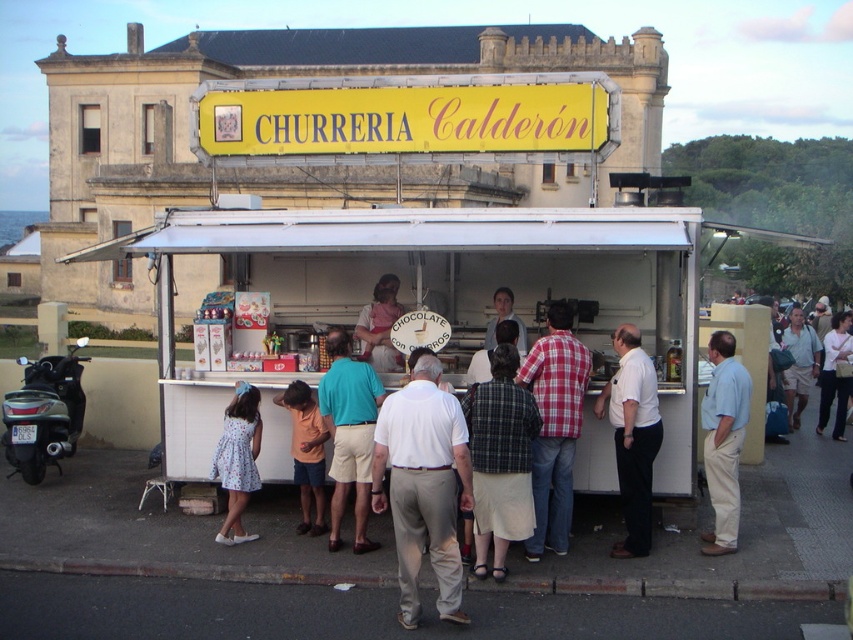
Locate an element on the screen. The image size is (853, 640). white shirt at center is located at coordinates (631, 436).

Does point (624, 328) come closer to viewer compared to point (798, 321)?

Yes, it is.

Find the location of a particular element. The image size is (853, 640). white shirt at center is located at coordinates (631, 436).

Is plaid fabric jacket at center shorter than khaki cotton shorts at center?

Yes, plaid fabric jacket at center is shorter than khaki cotton shorts at center.

Is plaid fabric jacket at center thinner than khaki cotton shorts at center?

Correct, plaid fabric jacket at center's width is less than khaki cotton shorts at center's.

Does point (503, 388) come behind point (793, 337)?

No, (503, 388) is closer to viewer.

Find the location of a particular element. This screenshot has height=640, width=853. plaid fabric jacket at center is located at coordinates (x=500, y=460).

Which is more to the left, teal fabric shirt at center or khaki cotton shorts at center?

teal fabric shirt at center is more to the left.

Does teal fabric shirt at center have a lesser width compared to khaki cotton shorts at center?

Indeed, teal fabric shirt at center has a lesser width compared to khaki cotton shorts at center.

What do you see at coordinates (349, 435) in the screenshot? Image resolution: width=853 pixels, height=640 pixels. I see `teal fabric shirt at center` at bounding box center [349, 435].

Identify the location of teal fabric shirt at center. Image resolution: width=853 pixels, height=640 pixels. (349, 435).